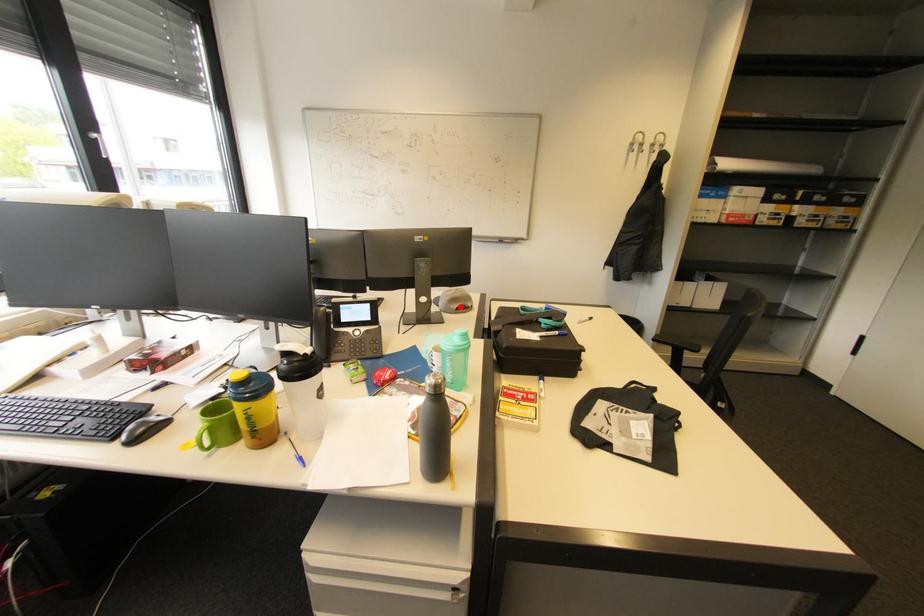
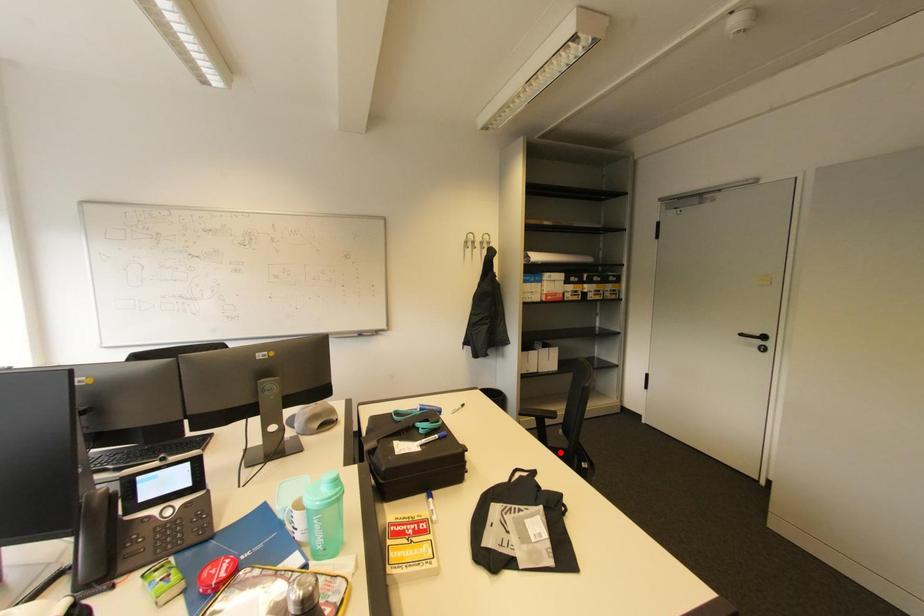
I am providing you with two images of the same scene from different viewpoints. A red point is marked on the first image and another point is marked on the second image. Are the points marked in image1 and image2 representing the same 3D position?

No